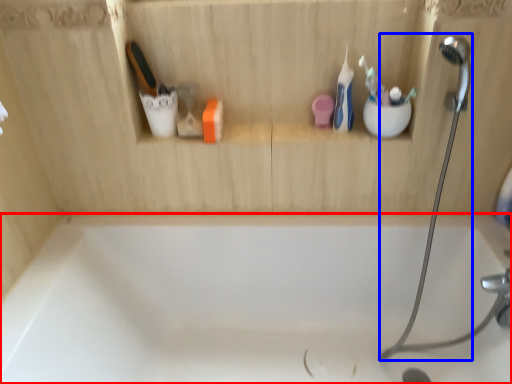
Question: Which object is closer to the camera taking this photo, bathtub (highlighted by a red box) or shower (highlighted by a blue box)?

Choices:
 (A) bathtub
 (B) shower

Answer: (B)